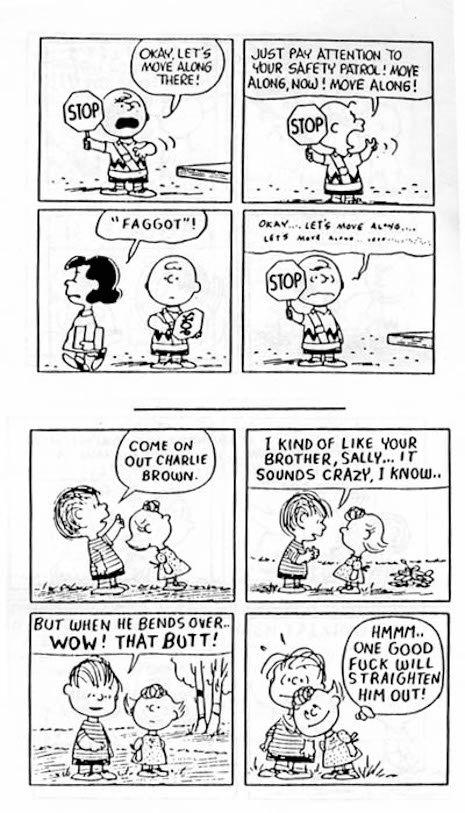
Locate an element on the screen. This screenshot has height=813, width=465. bottom right corner of panel is located at coordinates (230, 781), (446, 781), (450, 598), (236, 601), (230, 370), (432, 372), (432, 202), (230, 200).